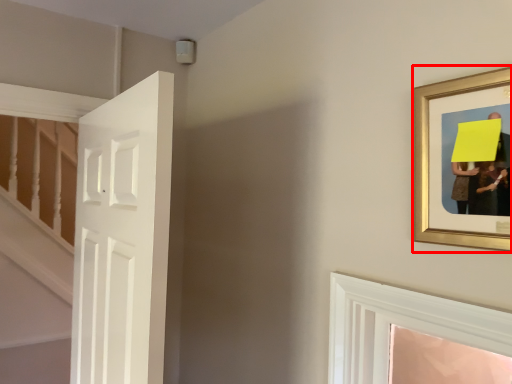
Question: In this image, where is picture frame (annotated by the red box) located relative to door?

Choices:
 (A) right
 (B) left

Answer: (A)